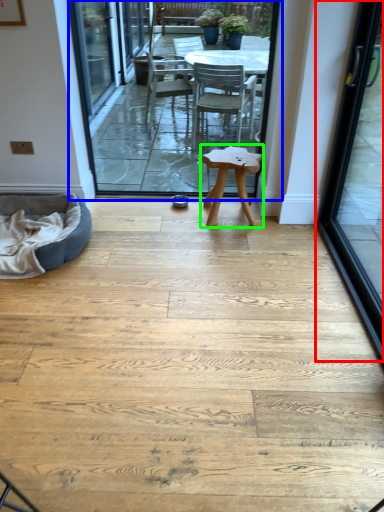
Question: Which object is positioned farthest from door (highlighted by a red box)? Select from terrace (highlighted by a blue box) and stool (highlighted by a green box).

Choices:
 (A) terrace
 (B) stool

Answer: (A)